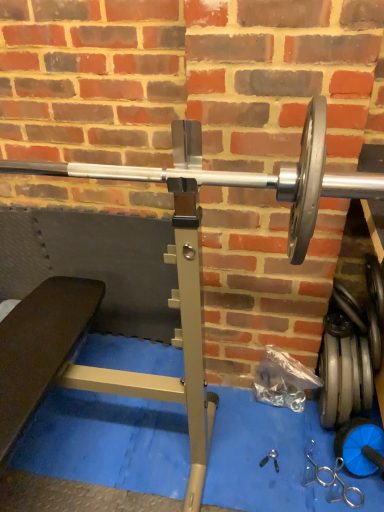
Question: Considering the relative sizes of silver metallic dumbbell at lower right, placed as the first dumbbell when sorted from top to bottom, and silver metallic barbell at center in the image provided, is silver metallic dumbbell at lower right, placed as the first dumbbell when sorted from top to bottom, wider than silver metallic barbell at center?

Choices:
 (A) yes
 (B) no

Answer: (B)

Question: Is silver metallic dumbbell at lower right, the second dumbbell ordered from the bottom, not close to silver metallic barbell at center?

Choices:
 (A) no
 (B) yes

Answer: (A)

Question: From the image's perspective, is silver metallic dumbbell at lower right, the second dumbbell ordered from the bottom, located above silver metallic barbell at center?

Choices:
 (A) no
 (B) yes

Answer: (A)

Question: Is silver metallic dumbbell at lower right, placed as the first dumbbell when sorted from top to bottom, further to the viewer compared to silver metallic barbell at center?

Choices:
 (A) yes
 (B) no

Answer: (A)

Question: Is silver metallic dumbbell at lower right, the second dumbbell ordered from the bottom, aimed at silver metallic barbell at center?

Choices:
 (A) no
 (B) yes

Answer: (A)

Question: Is silver metallic barbell at center surrounded by silver metallic dumbbell at lower right, the second dumbbell ordered from the bottom?

Choices:
 (A) yes
 (B) no

Answer: (B)

Question: Does blue rubber dumbbell at lower right, the second dumbbell viewed from the top, have a smaller size compared to silver metallic barbell at center?

Choices:
 (A) no
 (B) yes

Answer: (B)

Question: Is blue rubber dumbbell at lower right, the second dumbbell viewed from the top, in contact with silver metallic barbell at center?

Choices:
 (A) yes
 (B) no

Answer: (B)

Question: Is blue rubber dumbbell at lower right, arranged as the first dumbbell when ordered from the bottom, positioned beyond the bounds of silver metallic barbell at center?

Choices:
 (A) yes
 (B) no

Answer: (A)

Question: Does blue rubber dumbbell at lower right, the second dumbbell viewed from the top, lie behind silver metallic barbell at center?

Choices:
 (A) yes
 (B) no

Answer: (A)

Question: Does blue rubber dumbbell at lower right, the second dumbbell viewed from the top, have a larger size compared to silver metallic barbell at center?

Choices:
 (A) yes
 (B) no

Answer: (B)

Question: Is blue rubber dumbbell at lower right, the second dumbbell viewed from the top, far away from silver metallic barbell at center?

Choices:
 (A) yes
 (B) no

Answer: (B)

Question: Is silver metallic dumbbell at lower right, placed as the first dumbbell when sorted from top to bottom, taller than blue rubber dumbbell at lower right, arranged as the first dumbbell when ordered from the bottom?

Choices:
 (A) yes
 (B) no

Answer: (A)